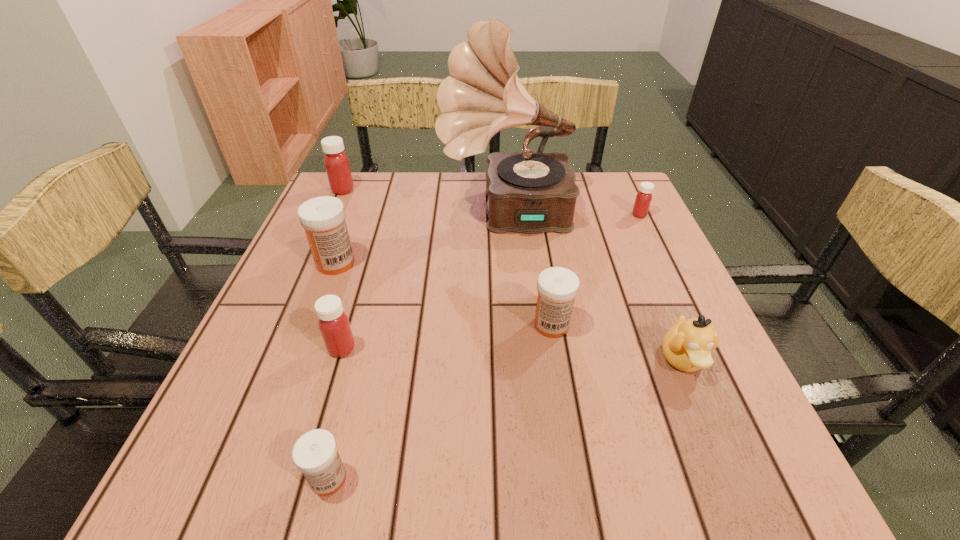
Locate an element on the screen. brown record player is located at coordinates (528, 192).

Find the location of a particular element. The height and width of the screenshot is (540, 960). the tallest object is located at coordinates (528, 192).

Locate an element on the screen. the biggest red medicine is located at coordinates (336, 162).

This screenshot has width=960, height=540. What are the coordinates of `the leftmost red medicine` in the screenshot? It's located at (336, 162).

Locate an element on the screen. Image resolution: width=960 pixels, height=540 pixels. the leftmost white medicine is located at coordinates (323, 218).

The width and height of the screenshot is (960, 540). What are the coordinates of `the fourth nearest medicine` in the screenshot? It's located at (323, 218).

Where is `the second biggest white medicine`? This screenshot has width=960, height=540. the second biggest white medicine is located at coordinates (557, 287).

Locate an element on the screen. the second farthest white medicine is located at coordinates click(x=557, y=287).

The height and width of the screenshot is (540, 960). What are the coordinates of `the second red medicine from right to left` in the screenshot? It's located at (334, 325).

You are a GUI agent. You are given a task and a screenshot of the screen. Output one action in this format:
    pyautogui.click(x=<x>, y=<y>)
    Task: Click on the second smallest red medicine
    The height and width of the screenshot is (540, 960).
    Given the screenshot: What is the action you would take?
    pyautogui.click(x=334, y=325)